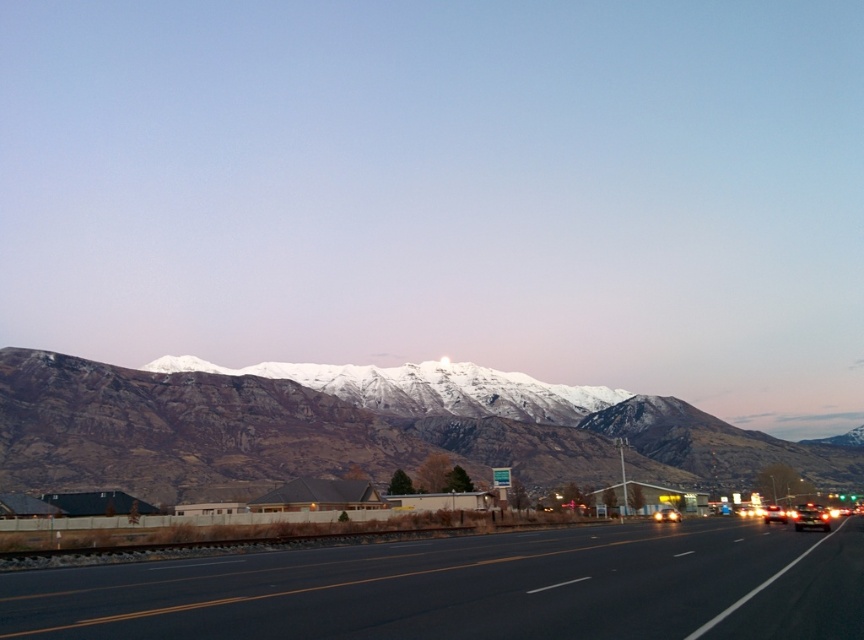
You are a delivery driver who needs to park your shiny silver sedan at center on the black asphalt highway at center. Considering the highway is wider than the car, can you safely park the car entirely within one lane without crossing any lane markings?

The black asphalt highway at center is wider than the shiny silver sedan at center. However, parking entirely within one lane without crossing lane markings depends on the lane width, not just the highway width. Since the highway has multiple lanes, each lane might be narrower than the car. Without knowing individual lane dimensions, it is uncertain if parking within a single lane is feasible.

You are standing at the point with coordinates point (811,516) in the image. What object are you standing on?

You are standing on the shiny black sedan at right.